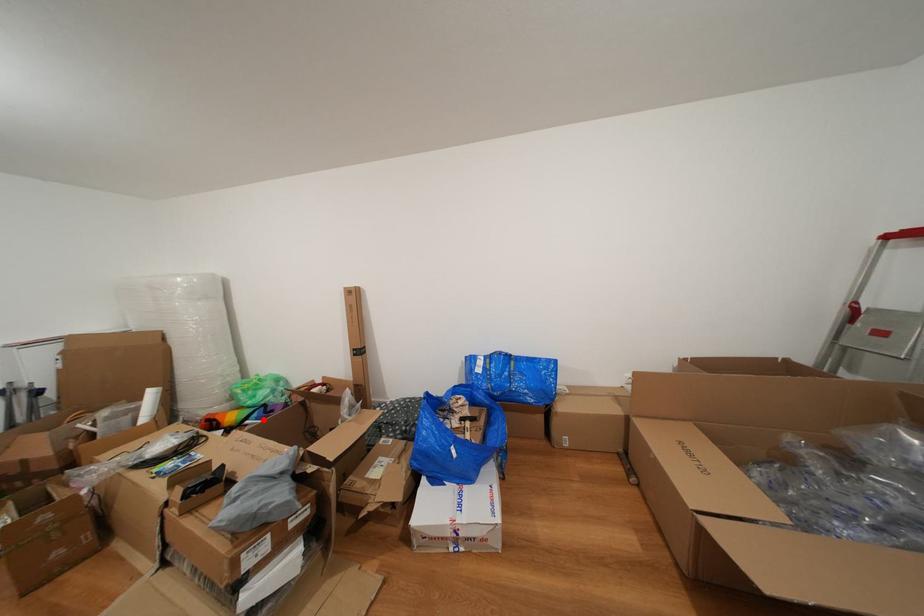
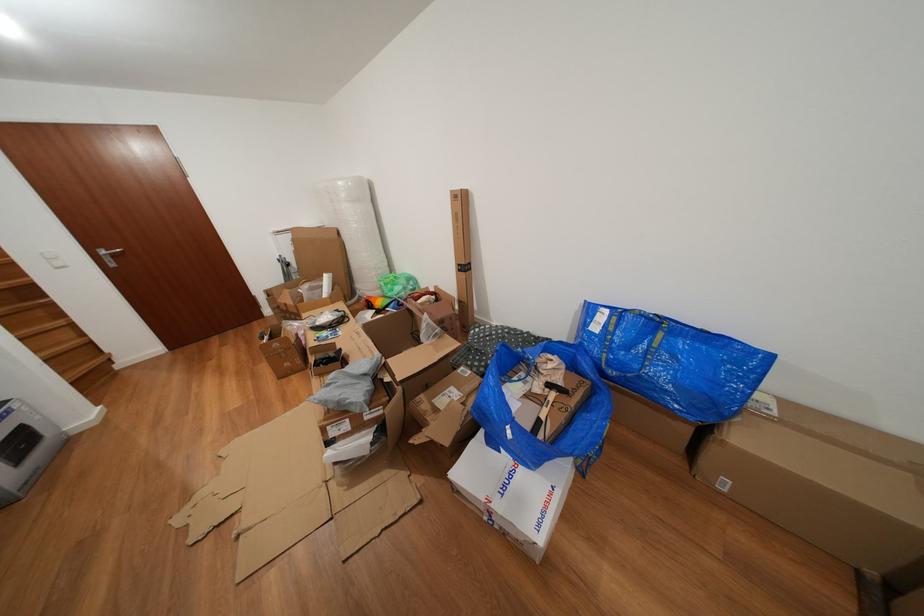
Where in the second image is the point corresponding to the highlighted location from the first image?

(399, 310)